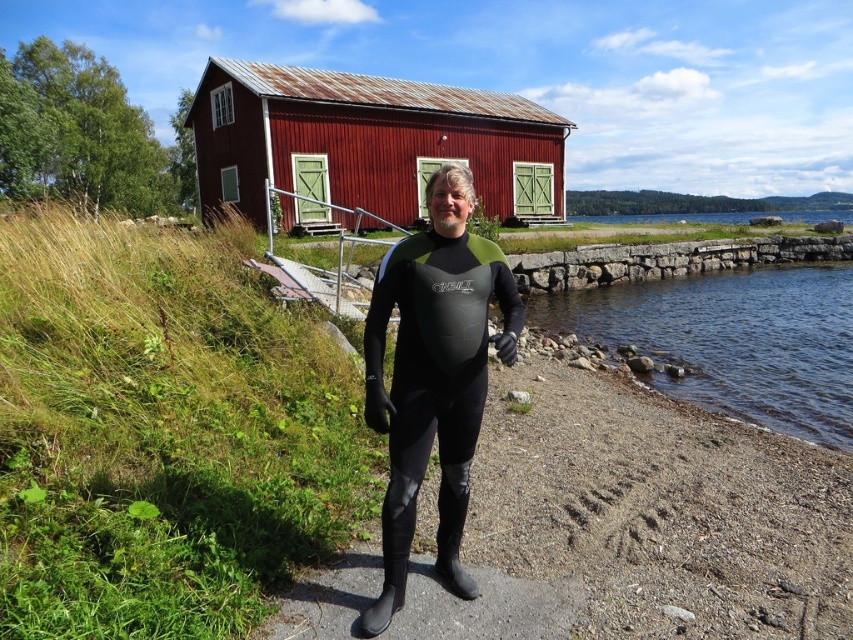
Does rustic wood hut at center have a lesser width compared to clear water at lower right?

No, rustic wood hut at center is not thinner than clear water at lower right.

Does rustic wood hut at center have a greater width compared to clear water at lower right?

Yes, rustic wood hut at center is wider than clear water at lower right.

Who is more distant from viewer, (421, 205) or (780, 422)?

The point (421, 205) is more distant.

The width and height of the screenshot is (853, 640). I want to click on rustic wood hut at center, so click(x=369, y=141).

Measure the distance between point (370, 209) and camera.

Point (370, 209) is 25.41 meters away from camera.

Is point (277, 180) in front of point (490, 266)?

No, it is behind (490, 266).

Image resolution: width=853 pixels, height=640 pixels. I want to click on rustic wood hut at center, so [x=369, y=141].

Does black neoprene wetsuit at center come behind clear water at lower right?

No, it is not.

Does black neoprene wetsuit at center come in front of clear water at lower right?

That is True.

The height and width of the screenshot is (640, 853). Identify the location of black neoprene wetsuit at center. 433,376.